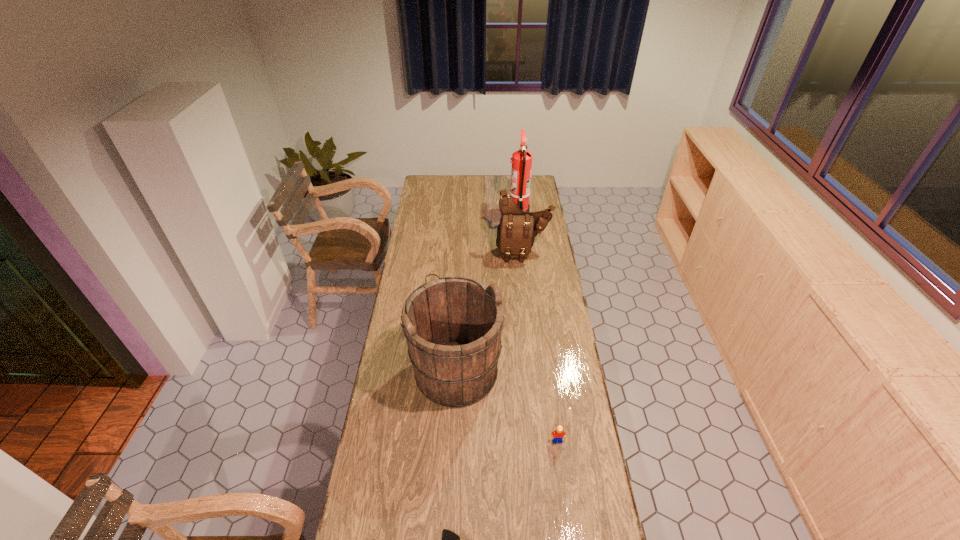
Where is `vacant region located at the nozzle of the tallest object`? Image resolution: width=960 pixels, height=540 pixels. vacant region located at the nozzle of the tallest object is located at coordinates tap(488, 213).

You are a GUI agent. You are given a task and a screenshot of the screen. Output one action in this format:
    pyautogui.click(x=<x>, y=<y>)
    Task: Click on the free location located on the front of the bucket
    
    Given the screenshot: What is the action you would take?
    pyautogui.click(x=452, y=462)

Find the location of `vacant position located 0.200m on the front-facing side of the third shortest object`. vacant position located 0.200m on the front-facing side of the third shortest object is located at coordinates (528, 291).

I want to click on vacant space situated on the front-facing side of the Lego, so click(x=566, y=504).

Locate an element on the screen. Image resolution: width=960 pixels, height=540 pixels. object present at the left edge is located at coordinates (452, 325).

This screenshot has height=540, width=960. Find the location of `fire extinguisher present at the right edge`. fire extinguisher present at the right edge is located at coordinates (521, 161).

This screenshot has height=540, width=960. Identify the location of shoulder bag that is at the right edge. (517, 229).

The width and height of the screenshot is (960, 540). What are the coordinates of `Lego that is at the right edge` in the screenshot? It's located at (559, 434).

Find the location of a particular element. Image resolution: width=960 pixels, height=540 pixels. free region at the far edge of the desktop is located at coordinates (478, 184).

Identify the location of free space at the left edge of the desktop. The width and height of the screenshot is (960, 540). (400, 501).